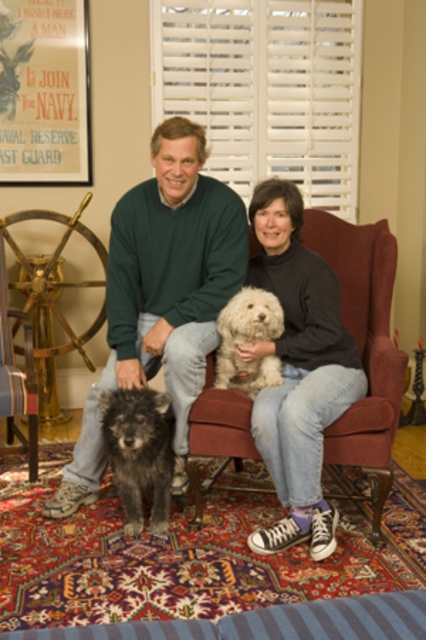
You are a photographer trying to capture a clear photo of the matte black turtleneck at center and the fuzzy dark brown dog at lower left. Which object is closer to the camera?

The matte black turtleneck at center is in front of the fuzzy dark brown dog at lower left, so it is closer to the camera.

You are a photographer setting up for a portrait. You need to ensure that the matte green sweater at center and the matte black turtleneck at center are both visible in the frame. Based on their positions, which one should you focus on first to ensure both are in focus?

The matte green sweater at center is located above the matte black turtleneck at center. To ensure both are in focus, you should focus on the matte green sweater at center first, as it is higher up, allowing the depth of field to naturally include the lower positioned matte black turtleneck at center.